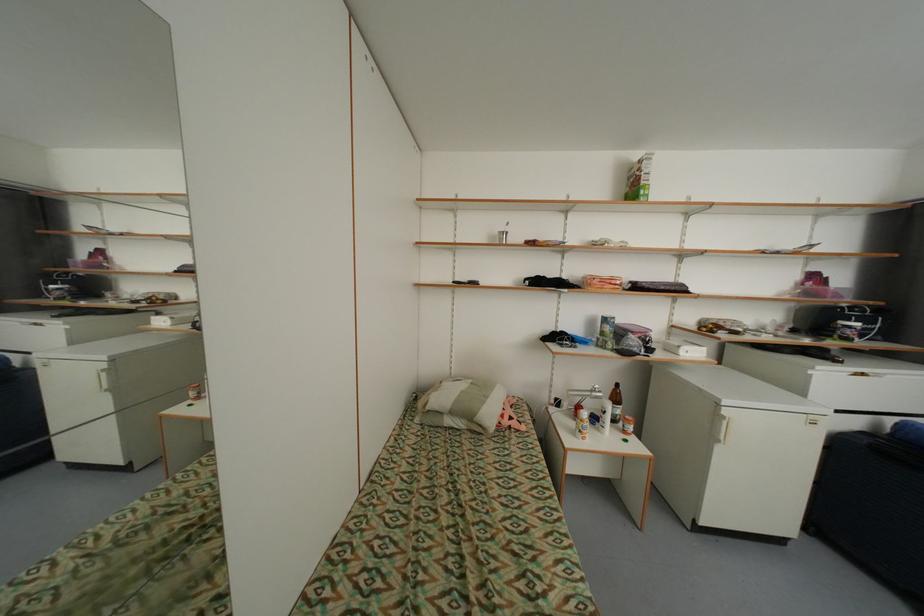
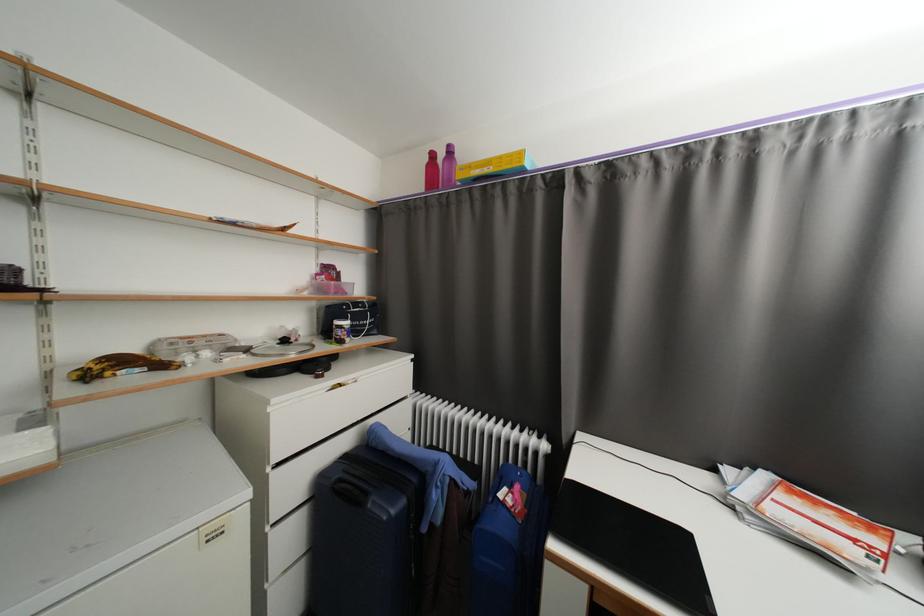
Find the pixel in the second image that matches [740,333] in the first image.

(167, 367)